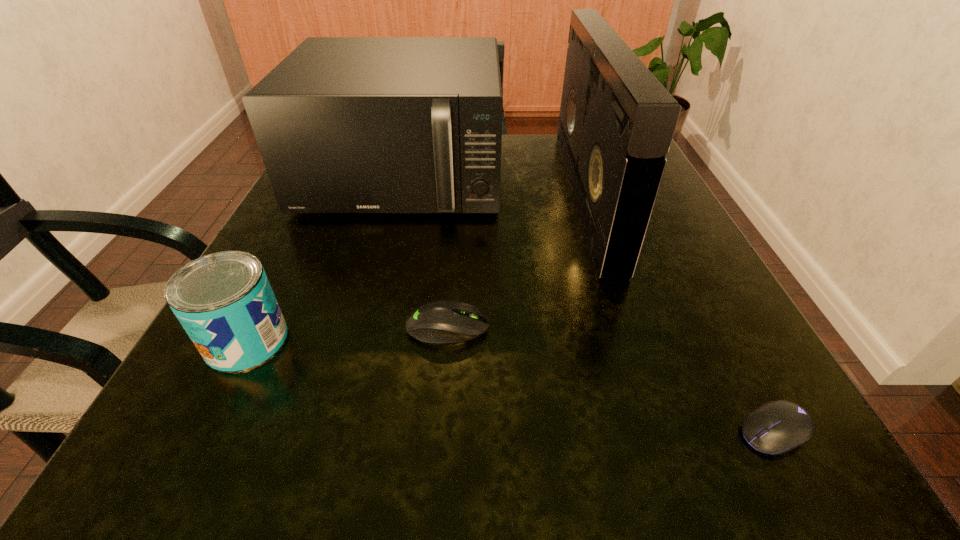
Identify the location of videotape positioned at the right edge. The image size is (960, 540). pos(616,124).

Where is `computer mouse located in the right edge section of the desktop`? Image resolution: width=960 pixels, height=540 pixels. computer mouse located in the right edge section of the desktop is located at coordinates (777, 427).

You are a GUI agent. You are given a task and a screenshot of the screen. Output one action in this format:
    pyautogui.click(x=<x>, y=<y>)
    Task: Click on the object situated at the far left corner
    
    Given the screenshot: What is the action you would take?
    pyautogui.click(x=344, y=124)

Locate an element on the screen. Image resolution: width=960 pixels, height=540 pixels. object located in the far right corner section of the desktop is located at coordinates (616, 124).

Find the location of a particular element. This screenshot has height=540, width=960. object situated at the near right corner is located at coordinates (777, 427).

In the image, there is a desktop. Where is `vacant space at the near edge`? The width and height of the screenshot is (960, 540). vacant space at the near edge is located at coordinates (461, 429).

I want to click on free space at the left edge of the desktop, so pyautogui.click(x=314, y=216).

In the image, there is a desktop. At what (x,y) coordinates should I click in order to perform the action: click on vacant space at the right edge. Please return your answer as a coordinate pair (x, y). The width and height of the screenshot is (960, 540). Looking at the image, I should click on (713, 301).

In the image, there is a desktop. At what (x,y) coordinates should I click in order to perform the action: click on free region at the near left corner. Please return your answer as a coordinate pair (x, y). The image size is (960, 540). Looking at the image, I should click on (283, 472).

This screenshot has height=540, width=960. What are the coordinates of `free space between the second object from right to left and the rightmost object` in the screenshot? It's located at (680, 313).